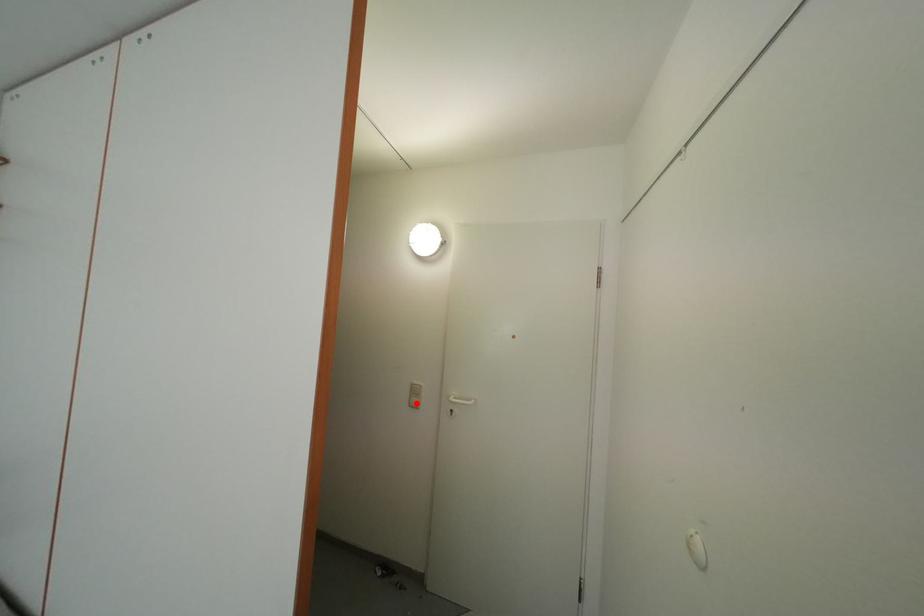
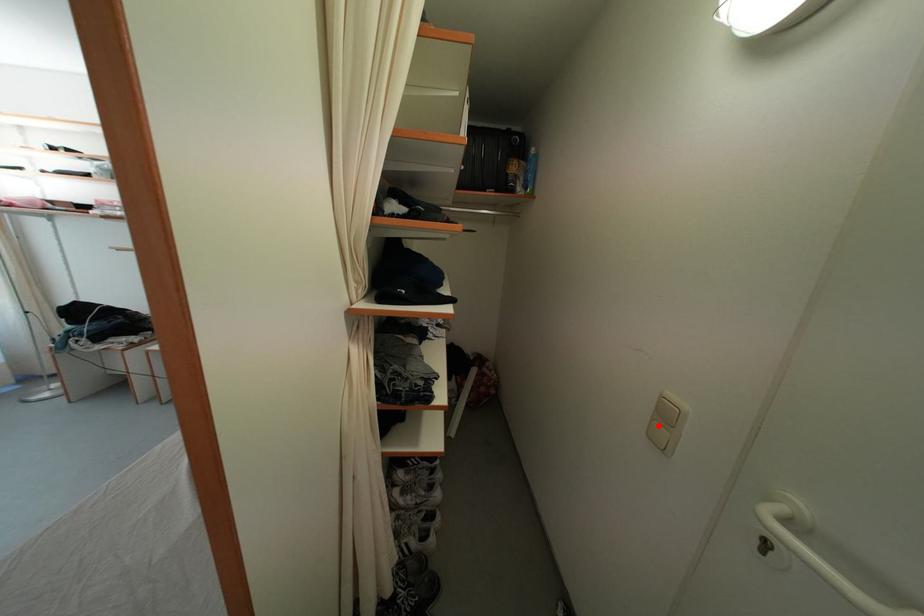
I am providing you with two images of the same scene from different viewpoints. A red point is marked on the first image and another point is marked on the second image. Are the points marked in image1 and image2 representing the same 3D position?

Yes